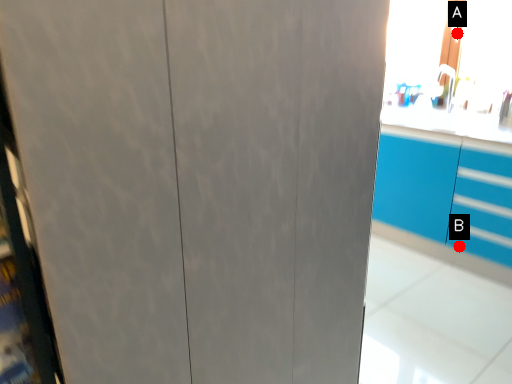
Question: Two points are circled on the image, labeled by A and B beside each circle. Which point is farther from the camera taking this photo?

Choices:
 (A) A is further
 (B) B is further

Answer: (A)